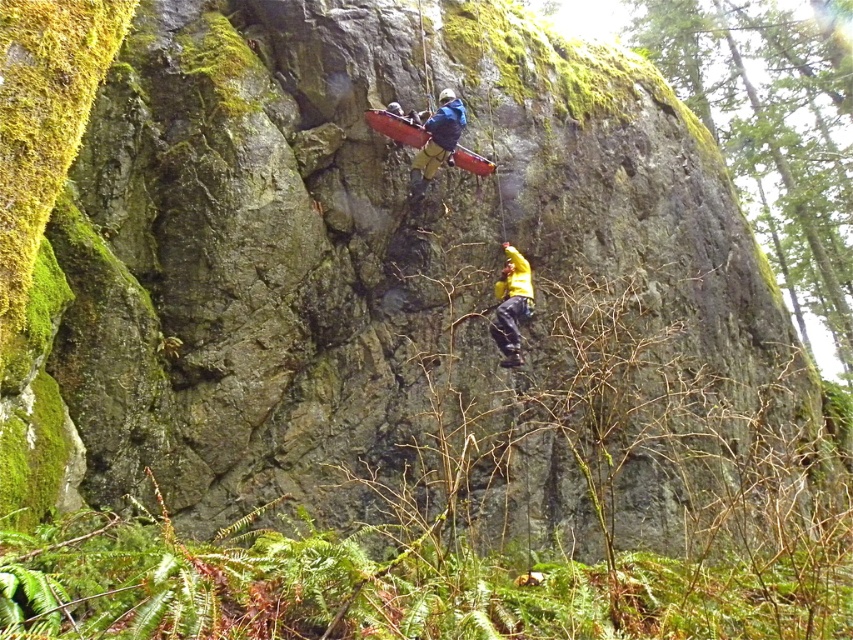
You are a hiker who has spotted two fabrics on the rock face while climbing. You need to secure your gear. Which fabric is positioned lower on the rock face between the yellow fabric at center and the blue fabric harness at upper center?

The yellow fabric at center is positioned lower on the rock face compared to the blue fabric harness at upper center.